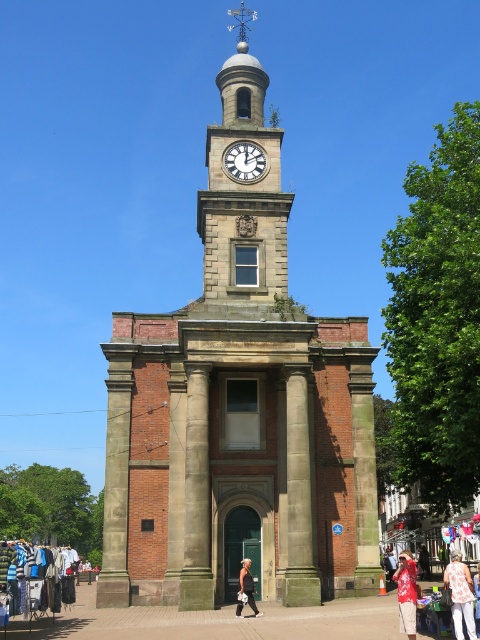
You are standing at a distance of 20 meters from the brown stone clock tower at center. Can you see the white glossy clock at center clearly from your current position?

The brown stone clock tower at center is 23.26 meters away from the white glossy clock at center. Since you are only 20 meters away from the brown stone clock tower at center, you are still 3.26 meters closer to it than the white glossy clock at center. Therefore, you can see the white glossy clock at center clearly from your current position.

You are standing in front of the clock tower and notice a light pink floral blouse at lower right. Based on its position, can you estimate where it is located relative to the clock tower?

The light pink floral blouse at lower right is located at the lower right corner of the image, near the base of the clock tower.

You are an artist sketching the clock tower. You notice two elements in your drawing that need adjustment. The light pink floral blouse at lower right and the white glossy clock at center are positioned incorrectly. Based on the scene description, which element should be moved upwards to correct their positions?

The light pink floral blouse at lower right should be moved upwards because it is currently below the white glossy clock at center, but according to the scene description, the clock is at the center of the tower, so the blouse should be placed below the clock to maintain proper positioning.